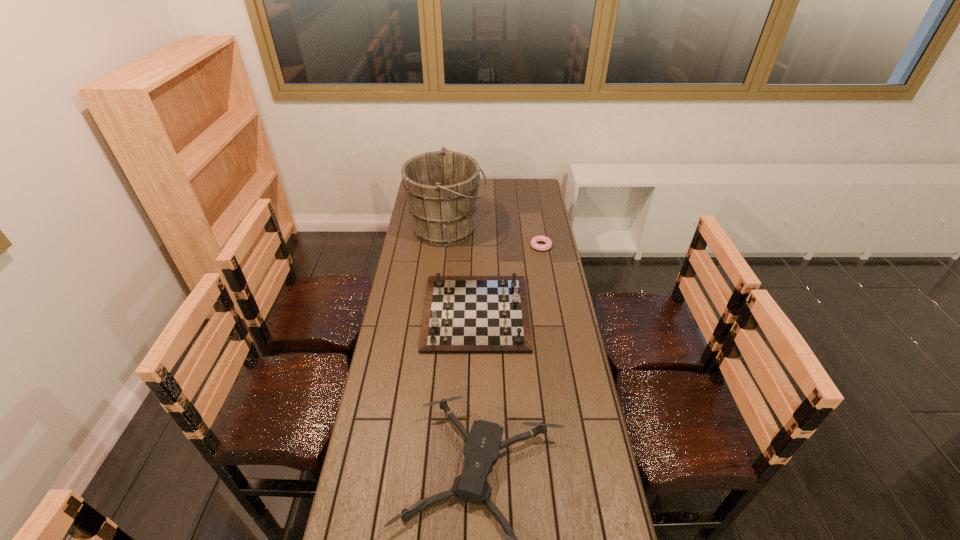
The image size is (960, 540). Find the location of `vacant position at the left edge of the desktop`. vacant position at the left edge of the desktop is located at coordinates (427, 273).

Find the location of a particular element. free location at the right edge of the desktop is located at coordinates (531, 254).

Where is `vacant space at the far right corner`? vacant space at the far right corner is located at coordinates (515, 178).

Identify the location of free point between the tallest object and the shortest object. (494, 237).

This screenshot has width=960, height=540. I want to click on empty space that is in between the shortest object and the tallest object, so click(494, 237).

The height and width of the screenshot is (540, 960). I want to click on free space that is in between the doughnut and the bucket, so click(x=494, y=237).

Locate which object is the closest to the drone. Please provide its 2D coordinates. Your answer should be formatted as a tuple, i.e. [(x, y)], where the tuple contains the x and y coordinates of a point satisfying the conditions above.

[(463, 314)]

This screenshot has height=540, width=960. Find the location of `the third closest object to the drone`. the third closest object to the drone is located at coordinates (441, 187).

At what (x,y) coordinates should I click in order to perform the action: click on vacant space that satisfies the following two spatial constraints: 1. on the handle side of the tallest object; 2. on the back side of the shortest object. Please return your answer as a coordinate pair (x, y). The image size is (960, 540). Looking at the image, I should click on (445, 246).

Locate an element on the screen. The width and height of the screenshot is (960, 540). vacant space that satisfies the following two spatial constraints: 1. on the front side of the shortest object; 2. on the board of the second nearest object is located at coordinates (553, 313).